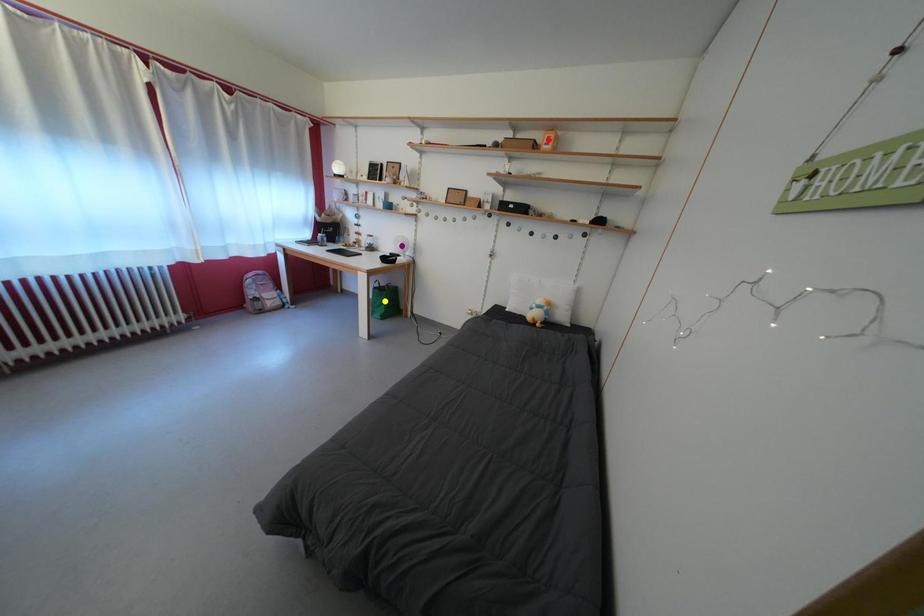
Order these from nearest to farthest:
purple point, red point, yellow point

red point → purple point → yellow point